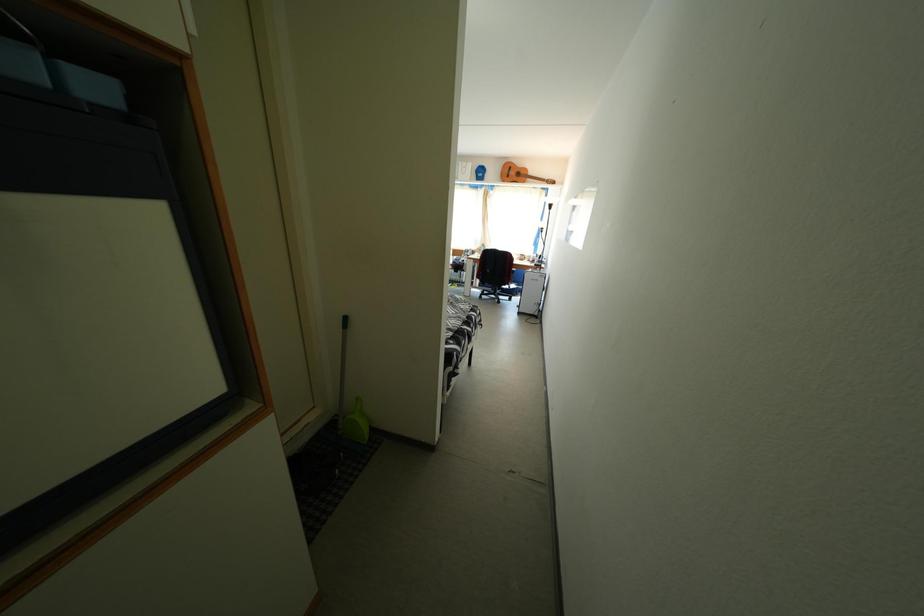
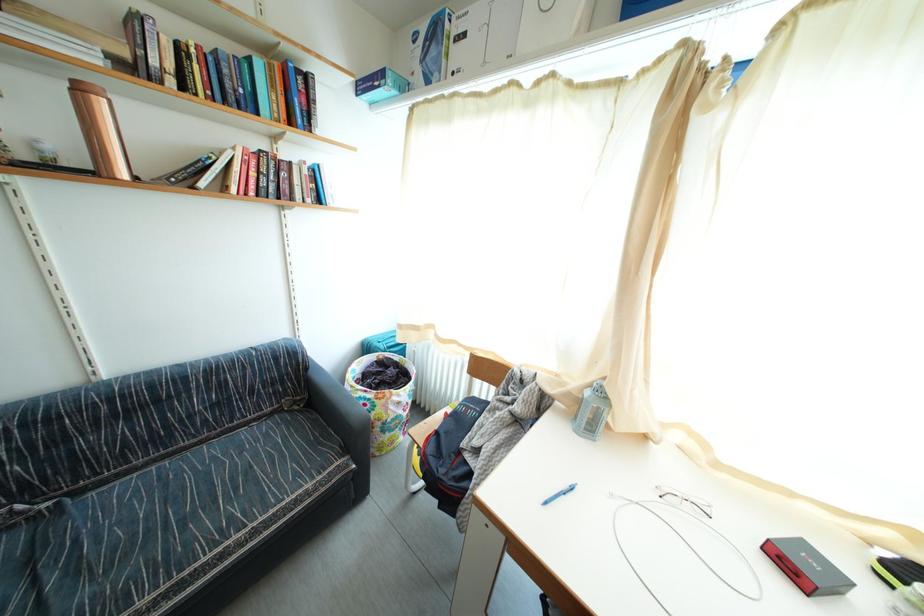
Question: In a continuous first-person perspective shot, in which direction is the camera moving?

Choices:
 (A) Left
 (B) Right
 (C) Forward
 (D) Backward

Answer: (C)